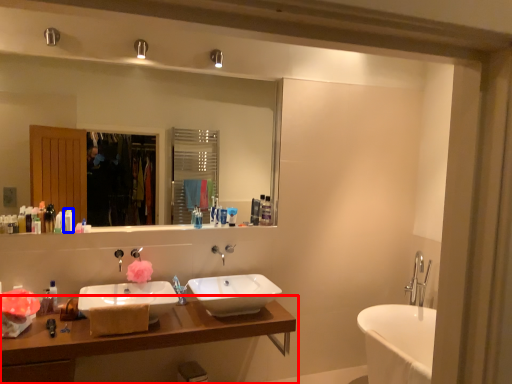
Question: Which point is closer to the camera, bathroom cabinet (highlighted by a red box) or toiletry (highlighted by a blue box)?

Choices:
 (A) bathroom cabinet
 (B) toiletry

Answer: (A)